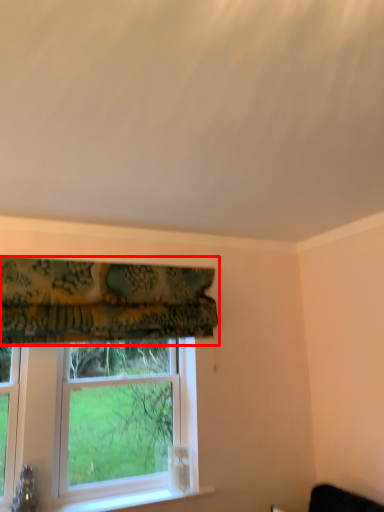
Question: From the image's perspective, what is the correct spatial positioning of curtain (annotated by the red box) in reference to window?

Choices:
 (A) below
 (B) above

Answer: (B)